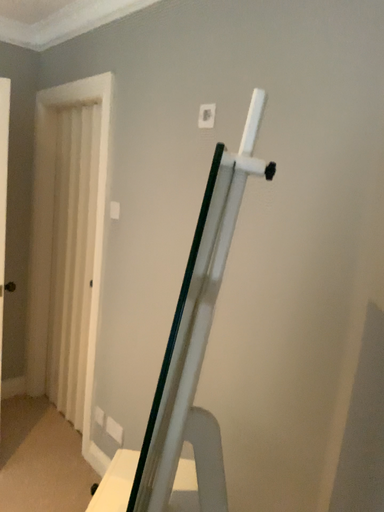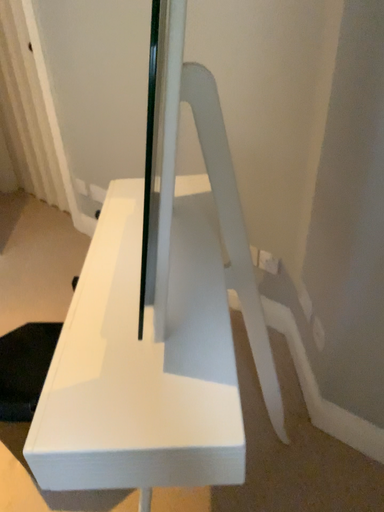
Question: How did the camera likely rotate when shooting the video?

Choices:
 (A) rotated upward
 (B) rotated downward

Answer: (B)